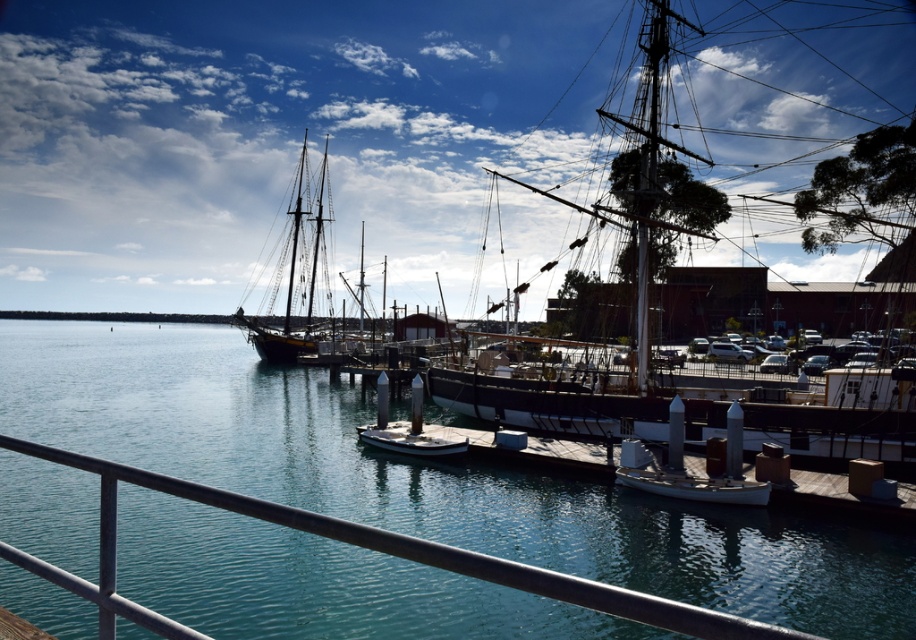
Question: Estimate the real-world distances between objects in this image. Which object is farther from the white matte dock at center?

Choices:
 (A) metallic gray rail at lower center
 (B) metallic silver posts at center
 (C) dark wood sailboat at center

Answer: (C)

Question: Among these objects, which one is farthest from the camera?

Choices:
 (A) white wooden ship at center
 (B) metallic silver posts at center
 (C) dark wood sailboat at center
 (D) white matte dock at center

Answer: (C)

Question: Among these objects, which one is nearest to the camera?

Choices:
 (A) metallic gray rail at lower center
 (B) white wooden ship at center

Answer: (A)

Question: Can you confirm if white wooden ship at center is positioned above dark wood sailboat at center?

Choices:
 (A) no
 (B) yes

Answer: (B)

Question: Is white wooden ship at center thinner than metallic gray rail at lower center?

Choices:
 (A) yes
 (B) no

Answer: (B)

Question: Is dark wood sailboat at center above metallic silver posts at center?

Choices:
 (A) no
 (B) yes

Answer: (B)